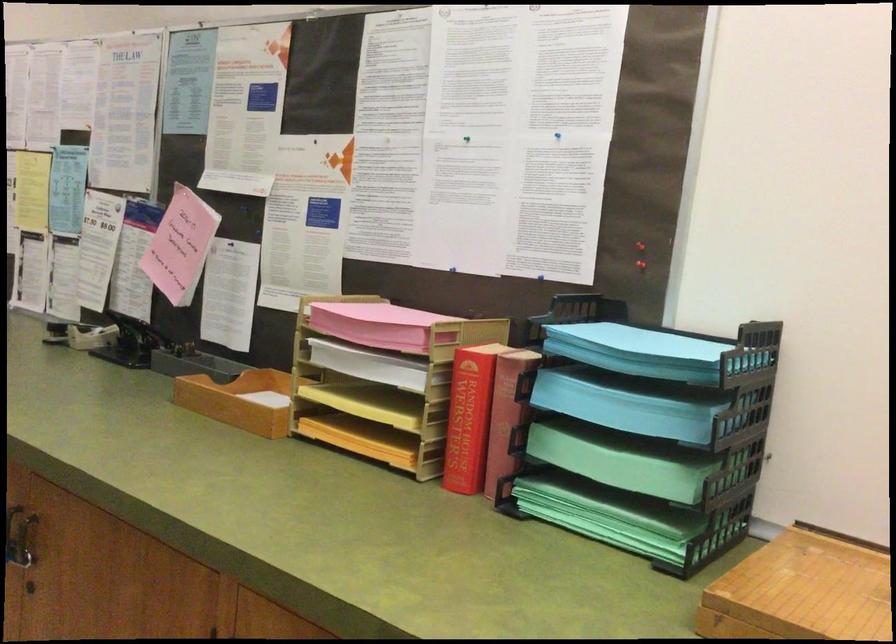
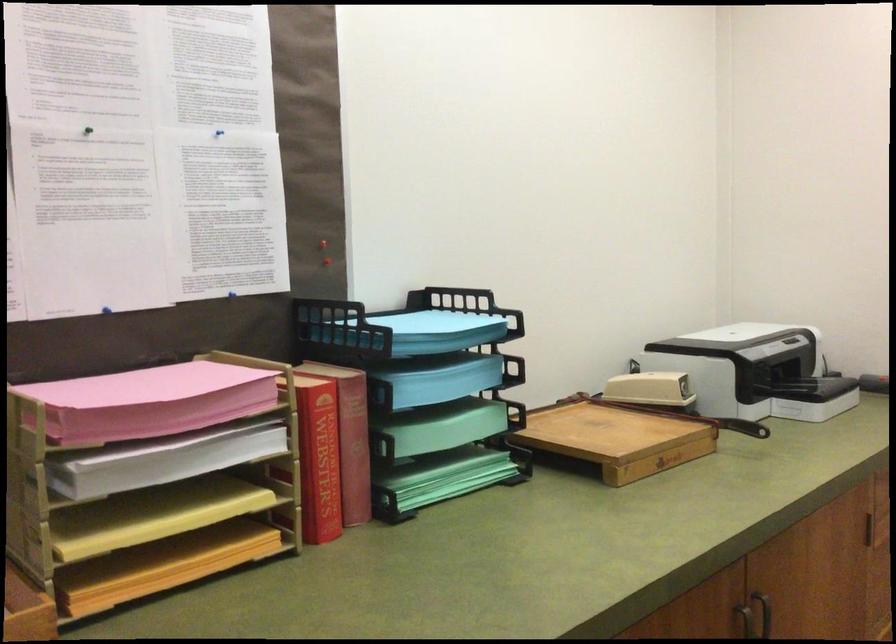
Find the pixel in the second image that matches the point at 376,325 in the first image.

(171, 406)